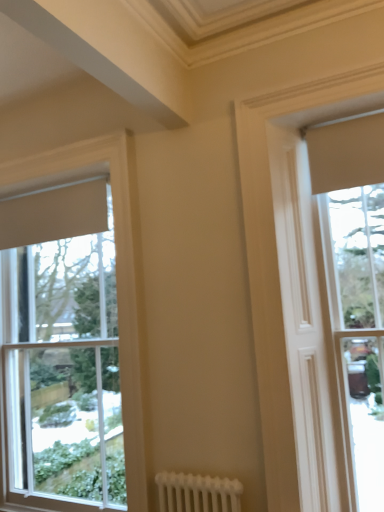
Question: In terms of width, does matte beige window at upper right, the second window when ordered from left to right, look wider or thinner when compared to matte beige curtain at right, the 1th window viewed from the right?

Choices:
 (A) thin
 (B) wide

Answer: (A)

Question: From the image's perspective, relative to matte beige curtain at right, the 1th window viewed from the right, is matte beige window at upper right, which is the 2th window from right to left, above or below?

Choices:
 (A) above
 (B) below

Answer: (A)

Question: Considering the real-world distances, which object is farthest from the matte beige curtain at right, the 1th window viewed from the right?

Choices:
 (A) white wood window at left, which ranks as the 1th window in left-to-right order
 (B) matte beige window at upper right, the second window when ordered from left to right

Answer: (A)

Question: Considering the real-world distances, which object is farthest from the matte beige window at upper right, the second window when ordered from left to right?

Choices:
 (A) matte beige curtain at right, the 1th window viewed from the right
 (B) white wood window at left, marked as the 3th window in a right-to-left arrangement

Answer: (B)